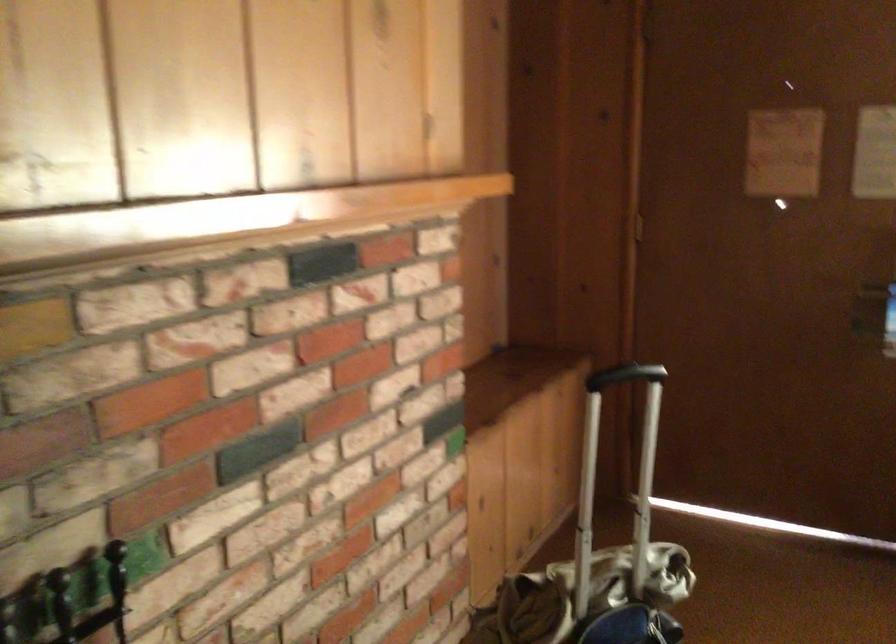
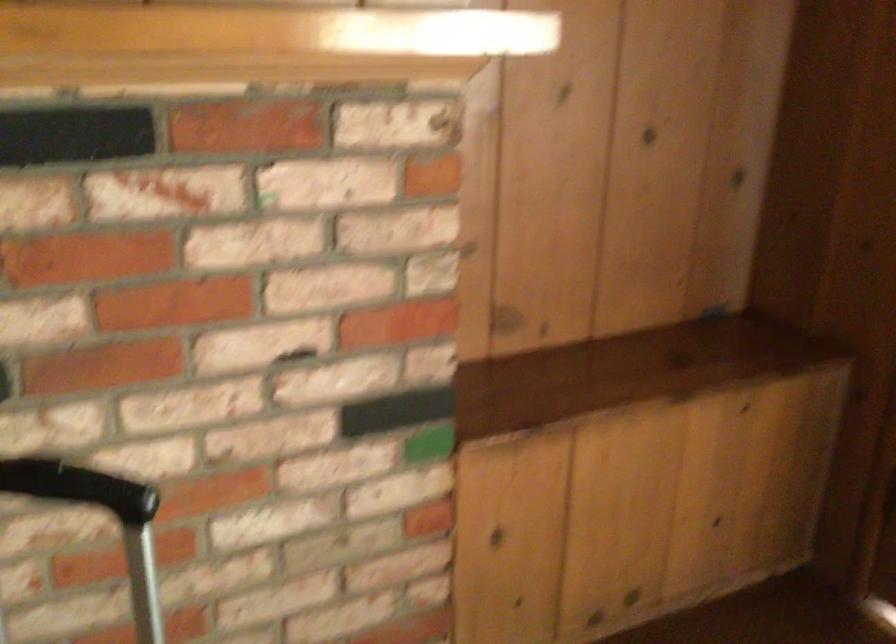
In the second image, find the point that corresponds to pixel 625 375 in the first image.

(138, 469)